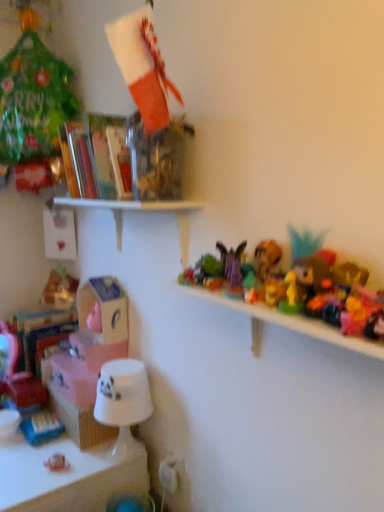
In order to click on vacant area in front of white glossy cup at lower left, which is the 3th shelf from top to bottom in this screenshot , I will do `click(58, 466)`.